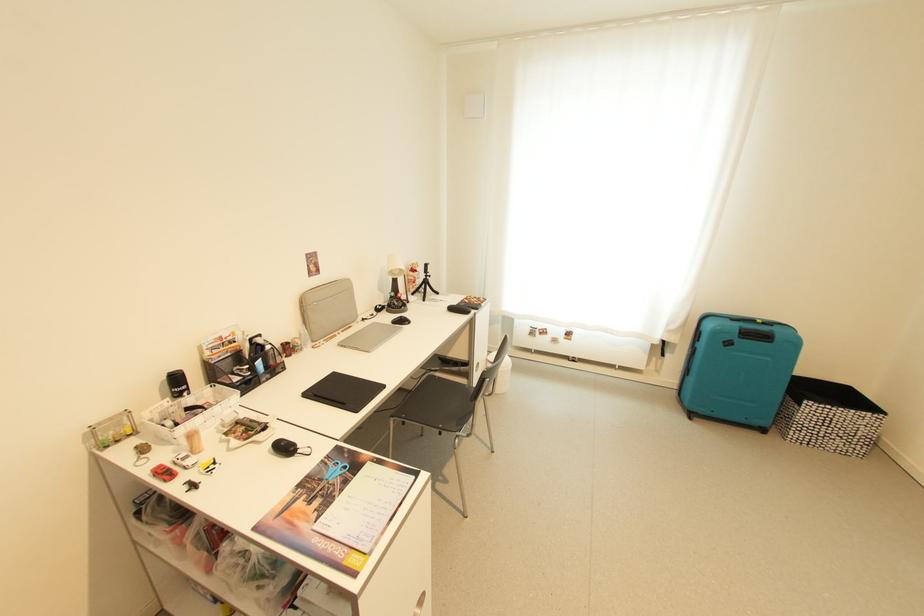
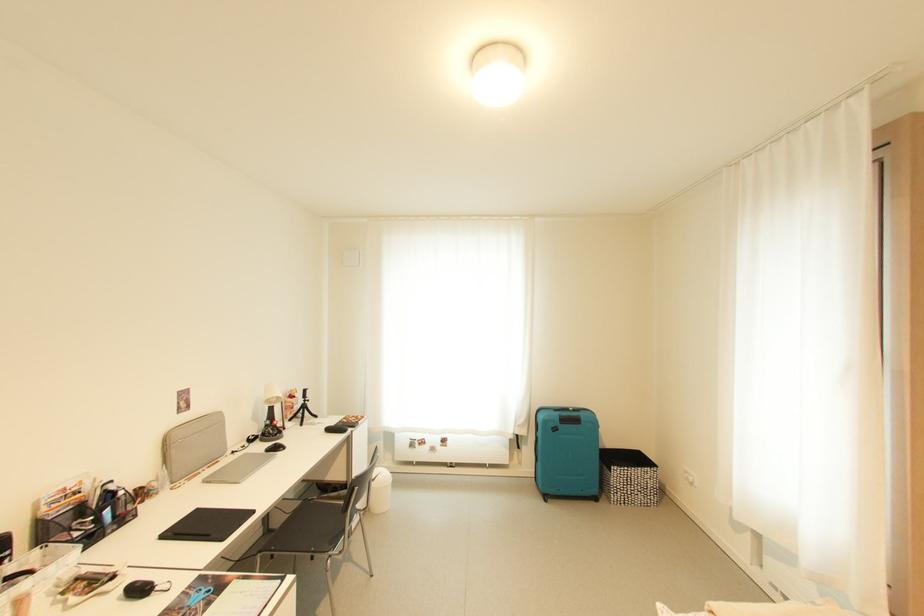
In the second image, find the point that corresponds to (x=338, y=375) in the first image.

(202, 512)